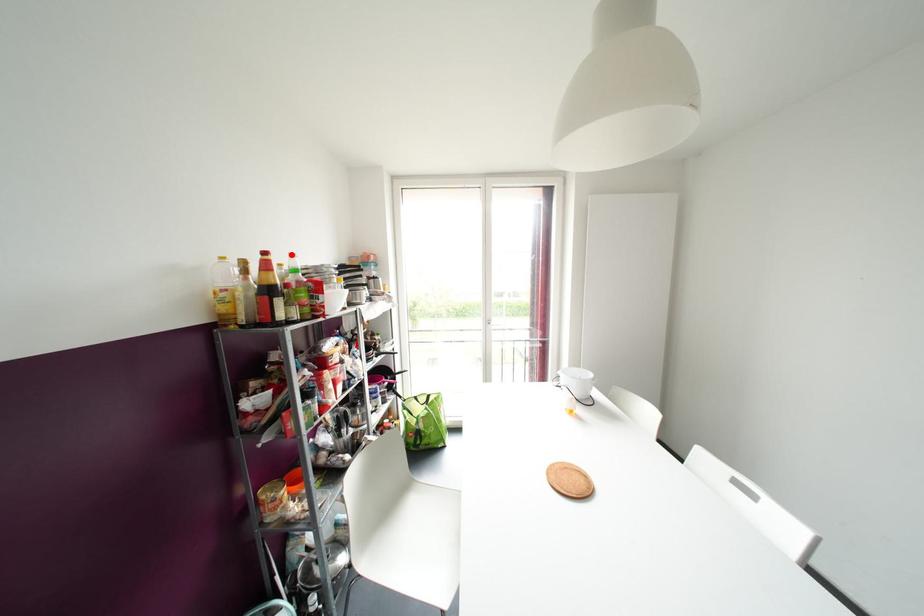
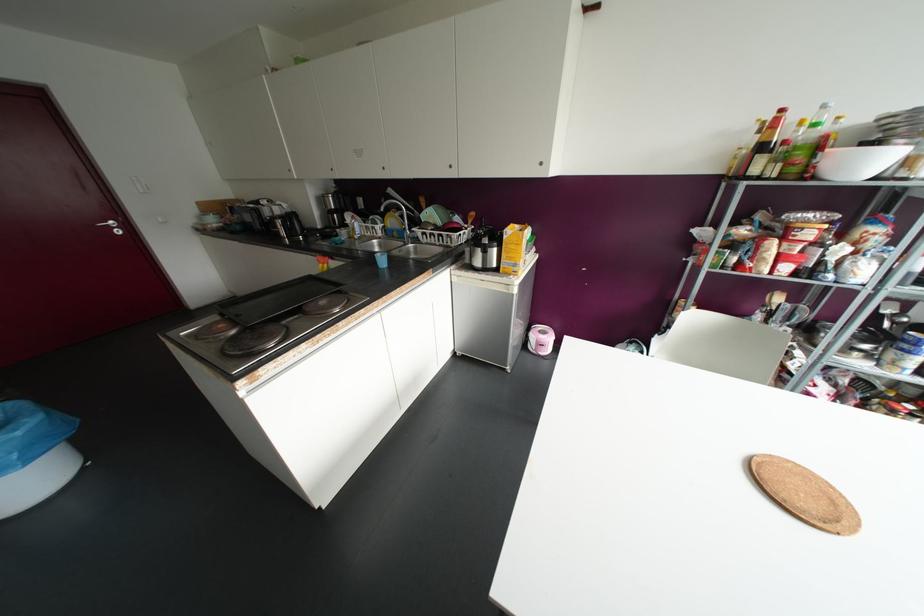
Question: I am providing you with two images of the same scene from different viewpoints. Image1 has a red point marked. In image2, the corresponding 3D location appears at what relative position? Reply with the corresponding letter.

Choices:
 (A) Closer
 (B) Farther

Answer: (B)